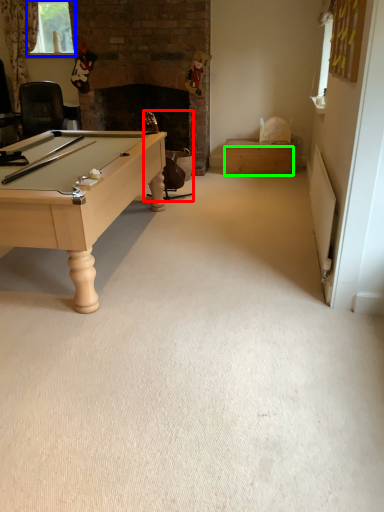
Question: Which object is the farthest from swivel chair (highlighted by a red box)? Choose among these: window screen (highlighted by a blue box) or drawer (highlighted by a green box).

Choices:
 (A) window screen
 (B) drawer

Answer: (A)